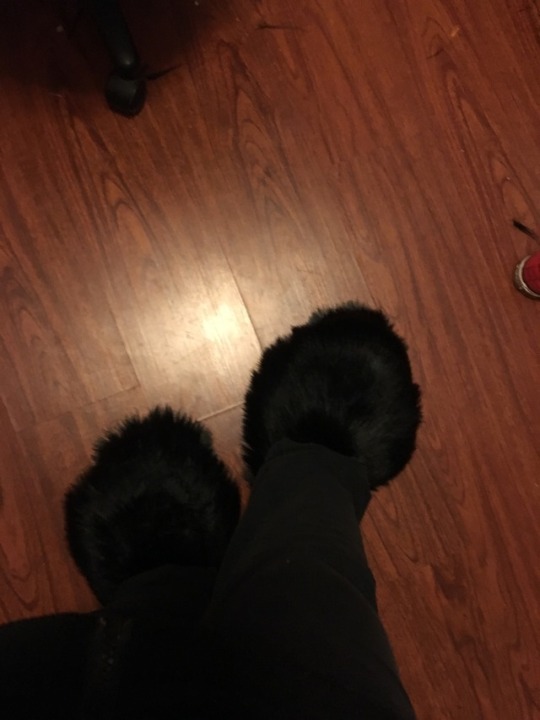
At what (x,y) coordinates should I click in order to perform the action: click on wood floor, brown. Please return your answer as a coordinate pair (x, y). Looking at the image, I should click on (36, 557).